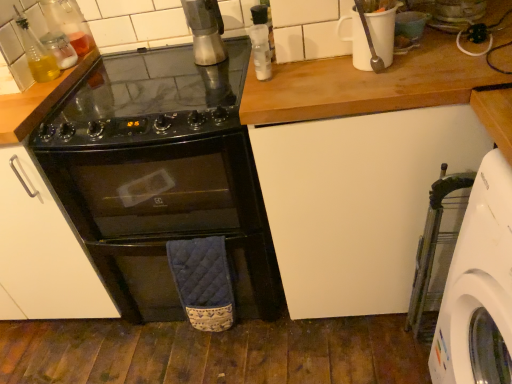
Question: Considering the positions of point (196, 13) and point (132, 59), is point (196, 13) closer or farther from the camera than point (132, 59)?

Choices:
 (A) farther
 (B) closer

Answer: (B)

Question: Considering the positions of metallic silver grinder at upper center and black glass gas stove at center in the image, is metallic silver grinder at upper center wider or thinner than black glass gas stove at center?

Choices:
 (A) thin
 (B) wide

Answer: (A)

Question: Which is farther from the black glass oven at center?

Choices:
 (A) white plastic washing machine at lower right
 (B) translucent glass bottle at upper left, marked as the first bottle in a left-to-right arrangement
 (C) white matte cabinet at center
 (D) transparent plastic bottle at upper center, arranged as the first bottle when viewed from the right
 (E) translucent glass bottle at upper left, positioned as the 2th bottle in right-to-left order

Answer: (A)

Question: Which object is positioned closest to the translucent glass bottle at upper left, the 3th bottle from the right?

Choices:
 (A) translucent glass bottle at upper left, positioned as the second bottle in left-to-right order
 (B) transparent plastic bottle at upper center, acting as the third bottle starting from the left
 (C) metallic silver grinder at upper center
 (D) white matte cabinet at center
 (E) white plastic washing machine at lower right

Answer: (A)